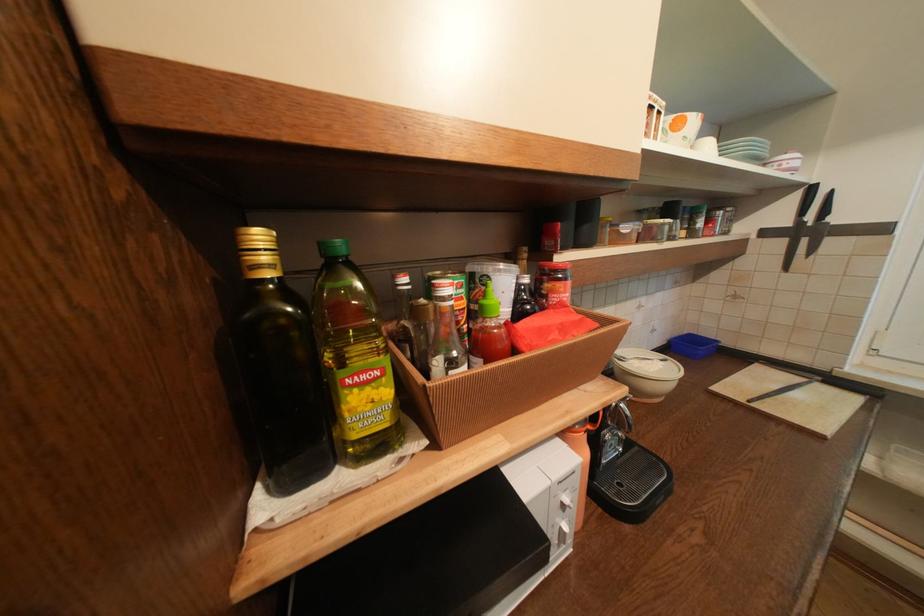
Find where to twist the green bottle cap. Please return your answer as a coordinate pair (x, y).

(334, 249)